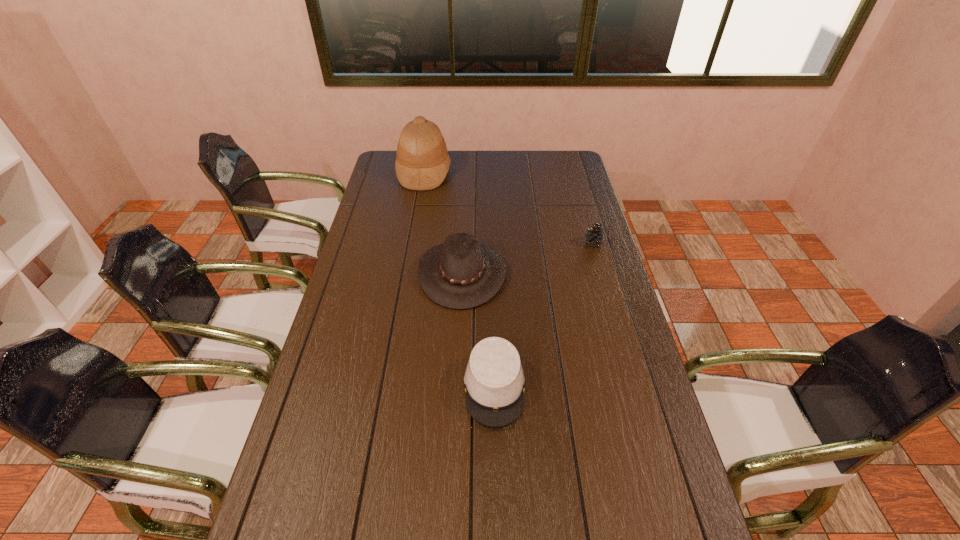
This screenshot has height=540, width=960. In order to click on the farthest hat in this screenshot , I will do `click(422, 162)`.

Find the location of a particular element. The height and width of the screenshot is (540, 960). the tallest hat is located at coordinates (422, 162).

Find the location of a particular element. This screenshot has height=540, width=960. the third shortest object is located at coordinates (462, 273).

Find the location of a particular element. the second shortest hat is located at coordinates (462, 273).

The image size is (960, 540). What are the coordinates of `pinecone` in the screenshot? It's located at (594, 236).

The height and width of the screenshot is (540, 960). In order to click on the shortest hat in this screenshot , I will do `click(494, 380)`.

The height and width of the screenshot is (540, 960). I want to click on the nearest object, so click(x=494, y=380).

Find the location of `blank space located 0.240m on the front-facing side of the farthest hat`. blank space located 0.240m on the front-facing side of the farthest hat is located at coordinates (504, 172).

Find the location of a particular element. Image resolution: width=960 pixels, height=540 pixels. vacant region located 0.090m on the front-facing side of the second farthest hat is located at coordinates (532, 273).

Locate an element on the screen. Image resolution: width=960 pixels, height=540 pixels. free point located 0.120m on the left of the pinecone is located at coordinates (552, 243).